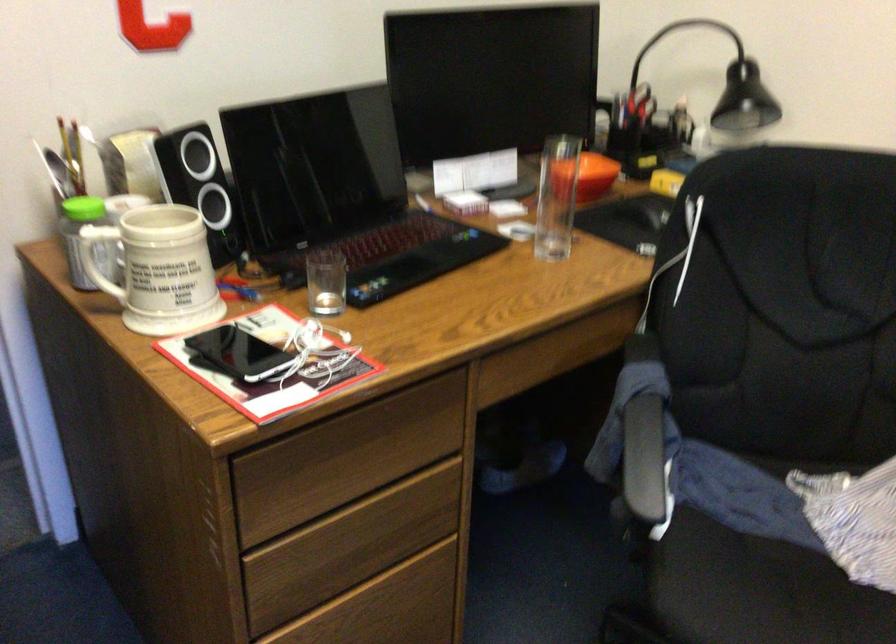
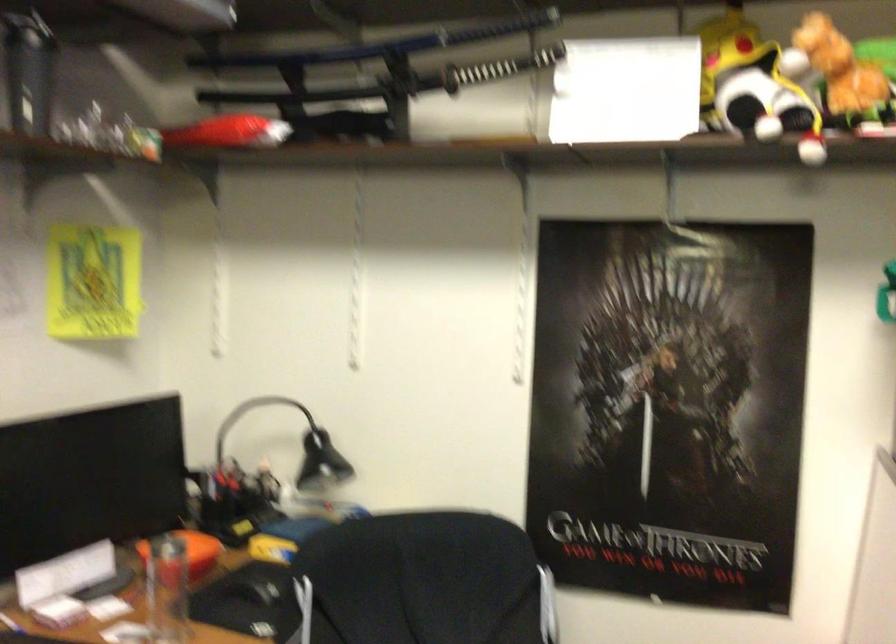
The first image is from the beginning of the video and the second image is from the end. How did the camera likely rotate when shooting the video?

The rotation direction of the camera is right-up.